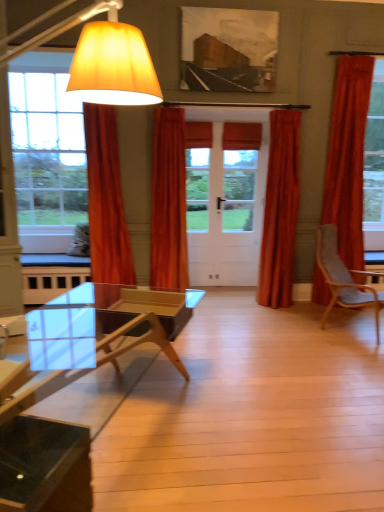
Locate an element on the screen. This screenshot has width=384, height=512. gray fabric chair at right is located at coordinates (345, 279).

Describe the element at coordinates (52, 26) in the screenshot. I see `matte yellow fabric lampshade at left` at that location.

Locate an element on the screen. satin orange curtain at center, the third curtain when ordered from left to right is located at coordinates (280, 211).

This screenshot has height=512, width=384. What are the coordinates of `transparent glass coffee table at lower left` in the screenshot? It's located at (94, 335).

Locate an element on the screen. This screenshot has height=512, width=384. orange velvet curtain at center, the third curtain positioned from the right is located at coordinates (168, 202).

The width and height of the screenshot is (384, 512). What do you see at coordinates (168, 202) in the screenshot? I see `orange velvet curtain at center, which ranks as the second curtain in left-to-right order` at bounding box center [168, 202].

The image size is (384, 512). In order to click on gray fabric chair at right in this screenshot , I will do `click(345, 279)`.

Could you tell me if satin orange curtain at center, the third curtain when ordered from left to right, is turned towards orange velvet curtain at center, the third curtain positioned from the right?

No, satin orange curtain at center, the third curtain when ordered from left to right, does not turn towards orange velvet curtain at center, the third curtain positioned from the right.

Based on the photo, in terms of size, does satin orange curtain at center, positioned as the 2th curtain in right-to-left order, appear bigger or smaller than orange velvet curtain at center, which ranks as the second curtain in left-to-right order?

Considering their sizes, satin orange curtain at center, positioned as the 2th curtain in right-to-left order, takes up less space than orange velvet curtain at center, which ranks as the second curtain in left-to-right order.

From the image's perspective, is satin orange curtain at center, positioned as the 2th curtain in right-to-left order, located above or below orange velvet curtain at center, which ranks as the second curtain in left-to-right order?

Clearly, from the image's perspective, satin orange curtain at center, positioned as the 2th curtain in right-to-left order, is above orange velvet curtain at center, which ranks as the second curtain in left-to-right order.

What's the angular difference between satin orange curtain at center, the third curtain when ordered from left to right, and orange velvet curtain at center, which ranks as the second curtain in left-to-right order,'s facing directions?

The angular difference between satin orange curtain at center, the third curtain when ordered from left to right, and orange velvet curtain at center, which ranks as the second curtain in left-to-right order, is 1.61 degrees.

Relative to transparent glass coffee table at lower left, is orange velvet curtain at center, which ranks as the second curtain in left-to-right order, in front or behind?

Visually, orange velvet curtain at center, which ranks as the second curtain in left-to-right order, is located behind transparent glass coffee table at lower left.

Considering the sizes of objects orange velvet curtain at center, which ranks as the second curtain in left-to-right order, and transparent glass coffee table at lower left in the image provided, who is smaller, orange velvet curtain at center, which ranks as the second curtain in left-to-right order, or transparent glass coffee table at lower left?

With smaller size is orange velvet curtain at center, which ranks as the second curtain in left-to-right order.

Could you tell me if orange velvet curtain at center, the third curtain positioned from the right, is turned towards transparent glass coffee table at lower left?

No, orange velvet curtain at center, the third curtain positioned from the right, is not aimed at transparent glass coffee table at lower left.

Does velvet orange curtain at right, arranged as the 4th curtain when viewed from the left, turn towards matte canvas picture frame at upper center?

No, velvet orange curtain at right, arranged as the 4th curtain when viewed from the left, is not facing towards matte canvas picture frame at upper center.

From the picture: From a real-world perspective, between velvet orange curtain at right, arranged as the 4th curtain when viewed from the left, and matte canvas picture frame at upper center, who is vertically lower?

In real-world perspective, velvet orange curtain at right, arranged as the 4th curtain when viewed from the left, is lower.

From the image's perspective, relative to matte canvas picture frame at upper center, is velvet orange curtain at right, placed as the 1th curtain when sorted from right to left, above or below?

Clearly, from the image's perspective, velvet orange curtain at right, placed as the 1th curtain when sorted from right to left, is below matte canvas picture frame at upper center.

Can you tell me how much velvet orange curtain at right, placed as the 1th curtain when sorted from right to left, and matte canvas picture frame at upper center differ in facing direction?

The facing directions of velvet orange curtain at right, placed as the 1th curtain when sorted from right to left, and matte canvas picture frame at upper center are 1.27 degrees apart.

Considering the sizes of objects velvet orange curtain at right, placed as the 1th curtain when sorted from right to left, and satin orange curtain at center, the third curtain when ordered from left to right, in the image provided, who is smaller, velvet orange curtain at right, placed as the 1th curtain when sorted from right to left, or satin orange curtain at center, the third curtain when ordered from left to right,?

With smaller size is satin orange curtain at center, the third curtain when ordered from left to right.

Is velvet orange curtain at right, placed as the 1th curtain when sorted from right to left, to the left of satin orange curtain at center, the third curtain when ordered from left to right, from the viewer's perspective?

Incorrect, velvet orange curtain at right, placed as the 1th curtain when sorted from right to left, is not on the left side of satin orange curtain at center, the third curtain when ordered from left to right.

This screenshot has height=512, width=384. I want to click on curtain on the right of satin orange curtain at center, positioned as the 2th curtain in right-to-left order, so click(x=347, y=157).

From the picture: From the image's perspective, would you say velvet orange curtain at right, placed as the 1th curtain when sorted from right to left, is positioned over satin orange curtain at center, positioned as the 2th curtain in right-to-left order?

Indeed, from the image's perspective, velvet orange curtain at right, placed as the 1th curtain when sorted from right to left, is shown above satin orange curtain at center, positioned as the 2th curtain in right-to-left order.

This screenshot has width=384, height=512. What are the coordinates of `coffee table located underneath the satin orange curtain at center, the third curtain when ordered from left to right (from a real-world perspective)` in the screenshot? It's located at (94, 335).

How different are the orientations of satin orange curtain at center, positioned as the 2th curtain in right-to-left order, and transparent glass coffee table at lower left in degrees?

107 degrees separate the facing orientations of satin orange curtain at center, positioned as the 2th curtain in right-to-left order, and transparent glass coffee table at lower left.

Is satin orange curtain at center, positioned as the 2th curtain in right-to-left order, spatially inside transparent glass coffee table at lower left, or outside of it?

The correct answer is: outside.

Considering the positions of objects velvet orange curtain at left, the 4th curtain viewed from the right, and transparent glass coffee table at lower left in the image provided, who is more to the left, velvet orange curtain at left, the 4th curtain viewed from the right, or transparent glass coffee table at lower left?

velvet orange curtain at left, the 4th curtain viewed from the right, is more to the left.

Is velvet orange curtain at left, acting as the first curtain starting from the left, further to the viewer compared to transparent glass coffee table at lower left?

Yes, the depth of velvet orange curtain at left, acting as the first curtain starting from the left, is greater than that of transparent glass coffee table at lower left.

Is velvet orange curtain at left, acting as the first curtain starting from the left, oriented towards transparent glass coffee table at lower left?

Yes, velvet orange curtain at left, acting as the first curtain starting from the left, is aimed at transparent glass coffee table at lower left.

Can you confirm if velvet orange curtain at left, the 4th curtain viewed from the right, is smaller than transparent glass coffee table at lower left?

Indeed, velvet orange curtain at left, the 4th curtain viewed from the right, has a smaller size compared to transparent glass coffee table at lower left.

Between velvet orange curtain at left, the 4th curtain viewed from the right, and matte yellow fabric lampshade at left, which one appears on the right side from the viewer's perspective?

Positioned to the right is velvet orange curtain at left, the 4th curtain viewed from the right.

Which point is more forward, [119,197] or [3,15]?

The point [3,15] is closer.

You are a GUI agent. You are given a task and a screenshot of the screen. Output one action in this format:
    pyautogui.click(x=<x>, y=<y>)
    Task: Click on the curtain that is the 1st one when counting backward from the matte yellow fabric lampshade at left
    
    Given the screenshot: What is the action you would take?
    pyautogui.click(x=106, y=199)

Based on the photo, considering the positions of objects velvet orange curtain at left, the 4th curtain viewed from the right, and matte yellow fabric lampshade at left in the image provided, who is in front, velvet orange curtain at left, the 4th curtain viewed from the right, or matte yellow fabric lampshade at left?

matte yellow fabric lampshade at left is in front.

Which curtain is the 2nd one when counting from the back of the orange velvet curtain at center, the third curtain positioned from the right? Please provide its 2D coordinates.

[(280, 211)]

I want to click on coffee table beneath the orange velvet curtain at center, the third curtain positioned from the right (from a real-world perspective), so click(x=94, y=335).

Considering their positions, is velvet orange curtain at right, placed as the 1th curtain when sorted from right to left, positioned further to transparent glass coffee table at lower left than gray fabric chair at right?

velvet orange curtain at right, placed as the 1th curtain when sorted from right to left.

Estimate the real-world distances between objects in this image. Which object is further from velvet orange curtain at left, acting as the first curtain starting from the left, matte canvas picture frame at upper center or gray fabric chair at right?

The object further to velvet orange curtain at left, acting as the first curtain starting from the left, is gray fabric chair at right.

From the image, which object appears to be nearer to satin orange curtain at center, positioned as the 2th curtain in right-to-left order, transparent glass coffee table at lower left or orange velvet curtain at center, which ranks as the second curtain in left-to-right order?

orange velvet curtain at center, which ranks as the second curtain in left-to-right order, is closer to satin orange curtain at center, positioned as the 2th curtain in right-to-left order.

Estimate the real-world distances between objects in this image. Which object is further from matte yellow fabric lampshade at left, velvet orange curtain at left, the 4th curtain viewed from the right, or transparent glass coffee table at lower left?

Among the two, transparent glass coffee table at lower left is located further to matte yellow fabric lampshade at left.

From the image, which object appears to be nearer to velvet orange curtain at right, arranged as the 4th curtain when viewed from the left, satin orange curtain at center, positioned as the 2th curtain in right-to-left order, or matte yellow fabric lampshade at left?

satin orange curtain at center, positioned as the 2th curtain in right-to-left order, is closer to velvet orange curtain at right, arranged as the 4th curtain when viewed from the left.

When comparing their distances from gray fabric chair at right, does velvet orange curtain at left, the 4th curtain viewed from the right, or matte canvas picture frame at upper center seem closer?

The object closer to gray fabric chair at right is matte canvas picture frame at upper center.

Based on their spatial positions, is transparent glass coffee table at lower left or orange velvet curtain at center, which ranks as the second curtain in left-to-right order, closer to matte yellow fabric lampshade at left?

orange velvet curtain at center, which ranks as the second curtain in left-to-right order, is positioned closer to the anchor matte yellow fabric lampshade at left.

Looking at this image, looking at the image, which one is located closer to matte yellow fabric lampshade at left, orange velvet curtain at center, the third curtain positioned from the right, or transparent glass coffee table at lower left?

orange velvet curtain at center, the third curtain positioned from the right, is closer to matte yellow fabric lampshade at left.

Where is `picture frame located between velvet orange curtain at left, the 4th curtain viewed from the right, and velvet orange curtain at right, placed as the 1th curtain when sorted from right to left, in the left-right direction`? This screenshot has height=512, width=384. picture frame located between velvet orange curtain at left, the 4th curtain viewed from the right, and velvet orange curtain at right, placed as the 1th curtain when sorted from right to left, in the left-right direction is located at coordinates (228, 50).

Where is `picture frame located between matte yellow fabric lampshade at left and satin orange curtain at center, positioned as the 2th curtain in right-to-left order, in the depth direction`? This screenshot has height=512, width=384. picture frame located between matte yellow fabric lampshade at left and satin orange curtain at center, positioned as the 2th curtain in right-to-left order, in the depth direction is located at coordinates (228, 50).

Locate an element on the screen. The image size is (384, 512). chair between transparent glass coffee table at lower left and satin orange curtain at center, the third curtain when ordered from left to right, in the front-back direction is located at coordinates (345, 279).

You are a GUI agent. You are given a task and a screenshot of the screen. Output one action in this format:
    pyautogui.click(x=<x>, y=<y>)
    Task: Click on the curtain between orange velvet curtain at center, the third curtain positioned from the right, and gray fabric chair at right
    
    Given the screenshot: What is the action you would take?
    pyautogui.click(x=280, y=211)